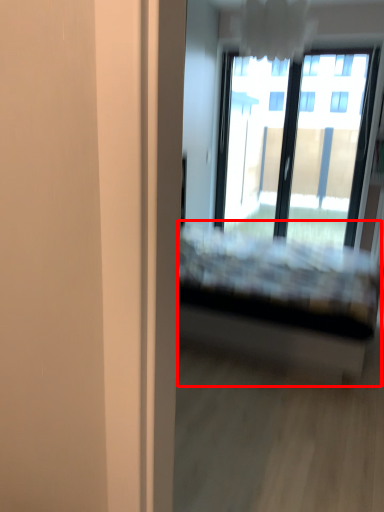
Question: From the image, what is the correct spatial relationship of bed (annotated by the red box) in relation to window?

Choices:
 (A) left
 (B) right

Answer: (A)